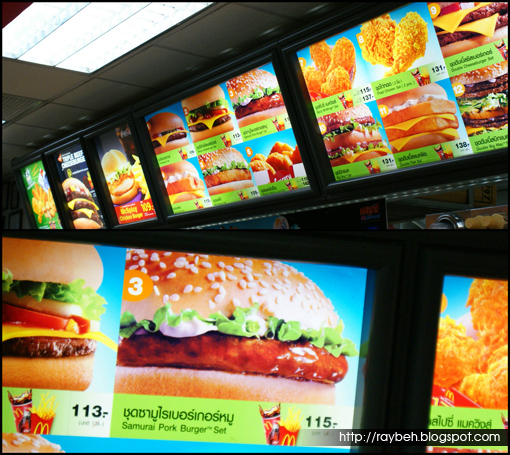
Where is `ceiling tiles`? The width and height of the screenshot is (510, 455). ceiling tiles is located at coordinates (294, 7), (240, 28), (168, 62), (114, 90), (48, 80), (47, 115), (30, 137), (16, 154), (16, 106).